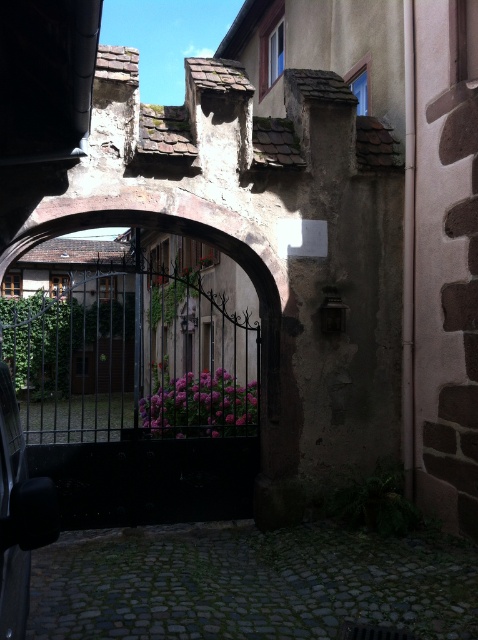
Can you confirm if black wrought iron gate at center is positioned below gray cobblestone alley at lower center?

Incorrect, black wrought iron gate at center is not positioned below gray cobblestone alley at lower center.

Who is positioned more to the left, black wrought iron gate at center or gray cobblestone alley at lower center?

black wrought iron gate at center is more to the left.

The width and height of the screenshot is (478, 640). In order to click on black wrought iron gate at center in this screenshot , I will do `click(162, 387)`.

Find the location of a particular element. The image size is (478, 640). black wrought iron gate at center is located at coordinates (162, 387).

Is black wrought iron gate at center wider than shiny black car at lower left?

Yes, black wrought iron gate at center is wider than shiny black car at lower left.

In order to click on black wrought iron gate at center in this screenshot , I will do `click(162, 387)`.

This screenshot has height=640, width=478. Identify the location of black wrought iron gate at center. (162, 387).

Does gray cobblestone alley at lower center have a greater width compared to shiny black car at lower left?

Yes, gray cobblestone alley at lower center is wider than shiny black car at lower left.

This screenshot has width=478, height=640. Find the location of `gray cobblestone alley at lower center`. gray cobblestone alley at lower center is located at coordinates (249, 582).

Is point (250, 570) behind point (8, 602)?

Yes.

This screenshot has height=640, width=478. In order to click on gray cobblestone alley at lower center in this screenshot , I will do `click(249, 582)`.